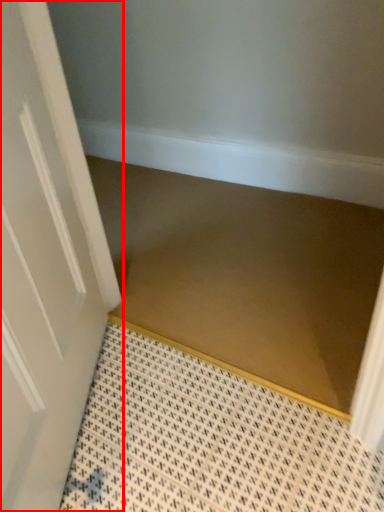
Question: Observing the image, what is the correct spatial positioning of door (annotated by the red box) in reference to stair?

Choices:
 (A) left
 (B) right

Answer: (A)